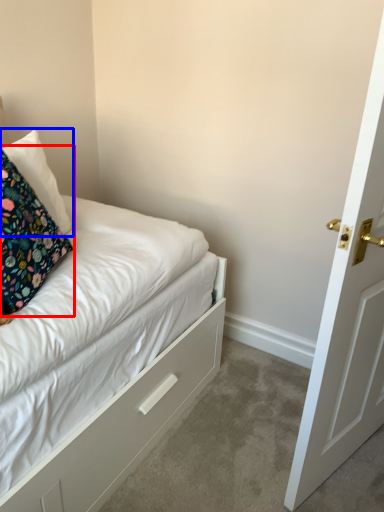
Question: Which point is closer to the camera, pillow (highlighted by a red box) or pillow (highlighted by a blue box)?

Choices:
 (A) pillow
 (B) pillow

Answer: (A)